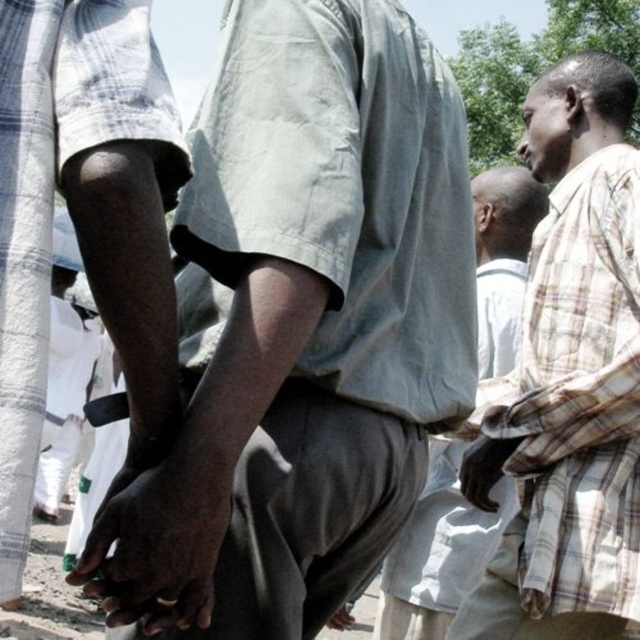
You are a photographer trying to capture a closeup shot of the dark skin hand at center and the light gray fabric pants at center. Which object should you focus on first if you want to ensure both are in frame without moving the camera?

The dark skin hand at center should be focused on first since it occupies less space than the light gray fabric pants at center, allowing you to adjust the framing to include both without moving the camera.

You are organizing a clothing drive and need to categorize shirts by size. You have a light gray cotton shirt at center and a plaid fabric shirt at right. Which shirt should you place in the small size bin?

The light gray cotton shirt at center is smaller than the plaid fabric shirt at right, so it should be placed in the small size bin.

You are organizing a clothing donation drive and need to categorize shirts by size. You have two shirts to sort today. The first is the light gray cotton shirt at center, and the second is the plaid fabric shirt at right. Which shirt should you place in the larger size bin?

The light gray cotton shirt at center has a larger width than the plaid fabric shirt at right, so it should be placed in the larger size bin.